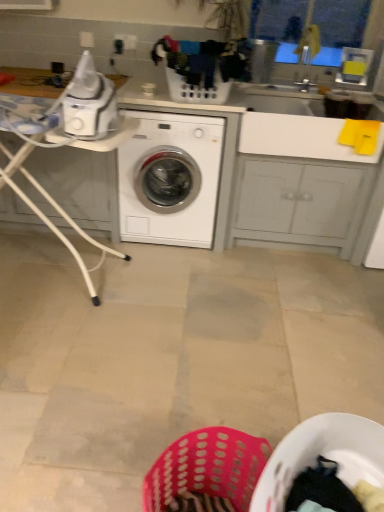
Question: Based on their positions, is transparent plastic window screen at upper right located to the left or right of white glossy counter top at upper left?

Choices:
 (A) right
 (B) left

Answer: (A)

Question: In the image, is transparent plastic window screen at upper right positioned in front of or behind white glossy counter top at upper left?

Choices:
 (A) behind
 (B) front

Answer: (A)

Question: Estimate the real-world distances between objects in this image. Which object is closer to the white plastic laundry basket at center?

Choices:
 (A) transparent plastic window screen at upper right
 (B) white glossy counter top at upper left
 (C) white glossy washing machine at center
 (D) white plastic table at left

Answer: (C)

Question: Estimate the real-world distances between objects in this image. Which object is farther from the white plastic table at left?

Choices:
 (A) transparent plastic window screen at upper right
 (B) white plastic laundry basket at center
 (C) white glossy washing machine at center
 (D) white glossy counter top at upper left

Answer: (A)